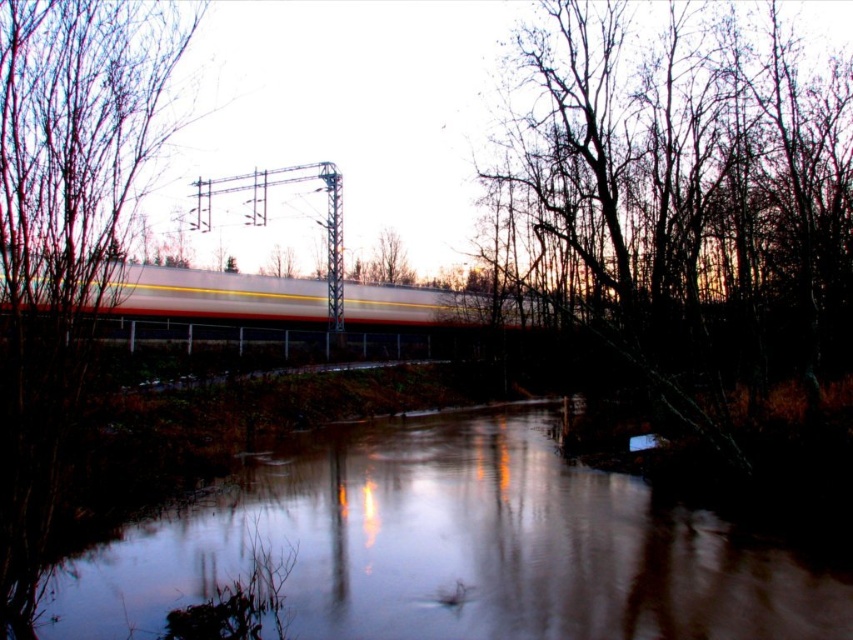
Question: Observing the image, what is the correct spatial positioning of smooth reflective water at center in reference to dark brown bark tree at right?

Choices:
 (A) left
 (B) right

Answer: (A)

Question: Considering the relative positions of smooth reflective water at center and dark brown bark tree at right in the image provided, where is smooth reflective water at center located with respect to dark brown bark tree at right?

Choices:
 (A) left
 (B) right

Answer: (A)

Question: Is smooth reflective water at center further to camera compared to dark brown bark tree at right?

Choices:
 (A) no
 (B) yes

Answer: (A)

Question: Among these objects, which one is farthest from the camera?

Choices:
 (A) dark brown bark tree at right
 (B) smooth reflective water at center

Answer: (A)

Question: Which object appears farthest from the camera in this image?

Choices:
 (A) smooth reflective water at center
 (B) dark brown bark tree at right

Answer: (B)